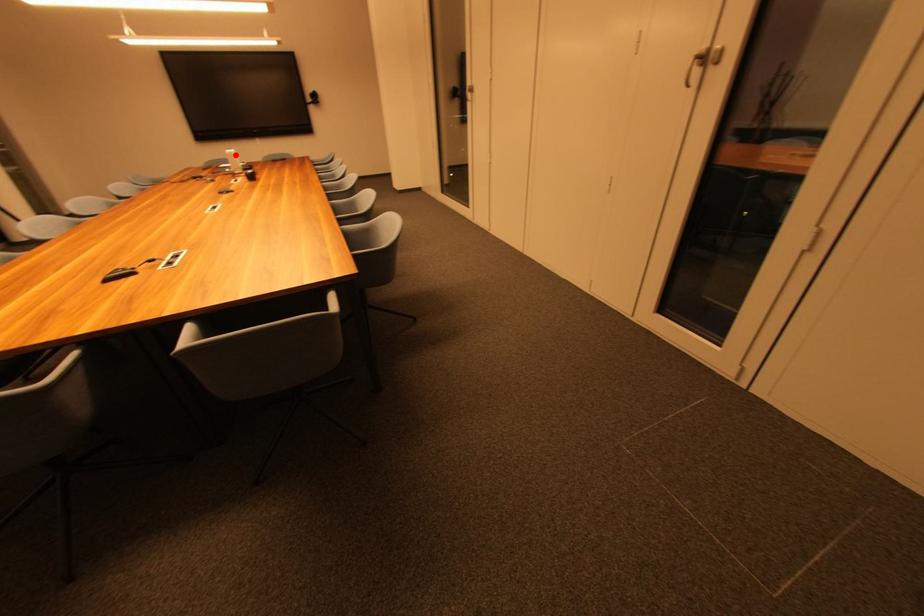
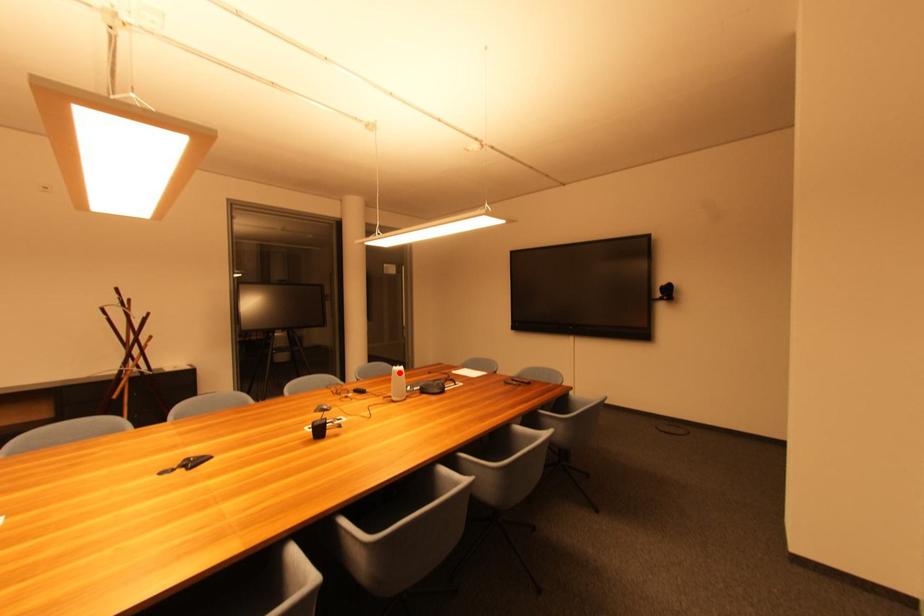
I am providing you with two images of the same scene from different viewpoints. A red point is marked on the first image and another point is marked on the second image. Is the marked point in image1 the same physical position as the marked point in image2?

Yes